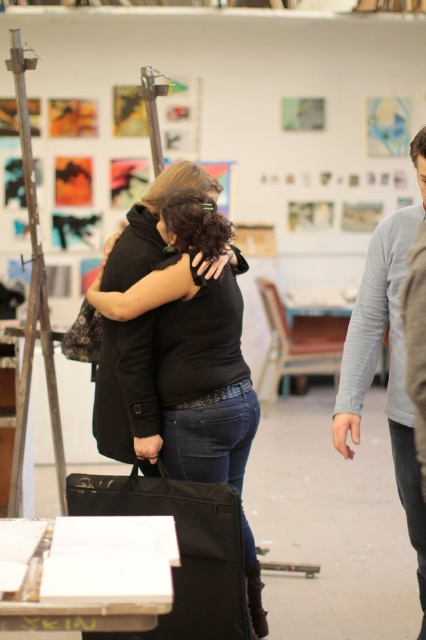
You are standing at point (354, 320) in the art studio. You want to reach the entrance door located at the far left wall. The minimum safe distance between you and any person is 2 meters to avoid disturbing them. Is the path to the door clear?

The two people in the art studio are 2.86 meters apart. Since the minimum safe distance required is 2 meters, the path to the door is clear as the distance between them exceeds the required safety distance.

You are an artist in the studio and want to hang a new painting that requires a hook placed at a height of 2 meters. Considering the gray cotton sweater at right and the black matte coat at center, which one is closer to the required height for the hook?

The gray cotton sweater at right is taller than the black matte coat at center, so the gray cotton sweater at right is closer to the required height of 2 meters for the hook.

You are an observer standing in the art studio. You see the gray cotton sweater at right and the black matte coat at center. Which object is closer to you?

The gray cotton sweater at right is closer to you since it is in front of the black matte coat at center.